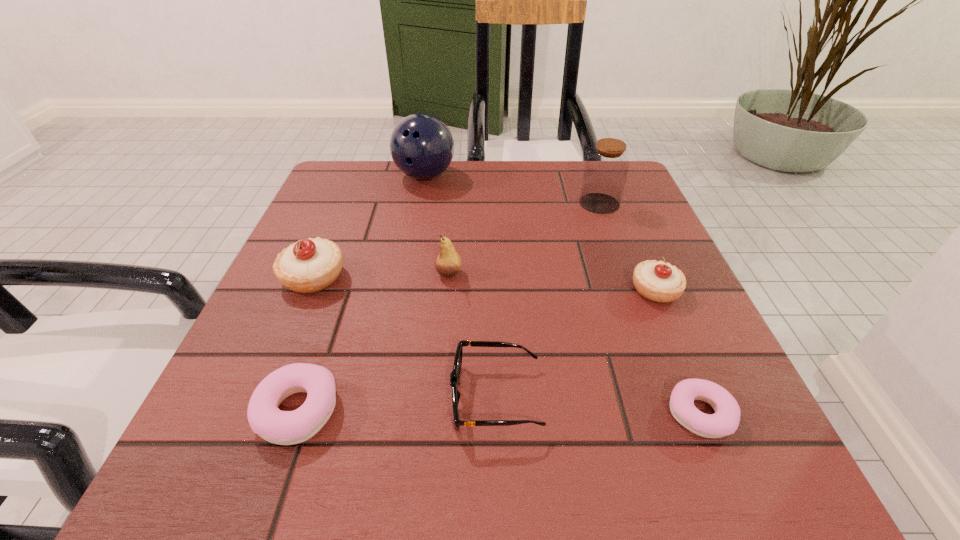
Locate an element on the screen. The height and width of the screenshot is (540, 960). blank space that satisfies the following two spatial constraints: 1. on the surface of the farthest object near the finger holes; 2. on the right side of the shortest object is located at coordinates (380, 414).

Identify the location of free space that satisfies the following two spatial constraints: 1. on the front side of the shortest pastry; 2. on the left side of the bigger beige pastry. The width and height of the screenshot is (960, 540). (256, 414).

This screenshot has height=540, width=960. In order to click on free space that satisfies the following two spatial constraints: 1. on the surface of the second tallest pastry near the finger holes; 2. on the left side of the blue bowling ball in this screenshot , I will do `click(403, 290)`.